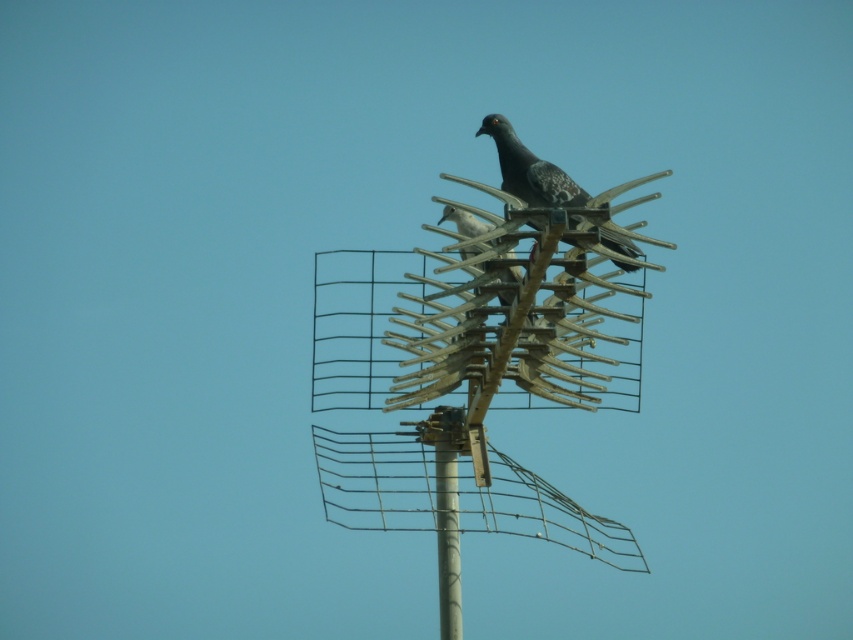
Who is more forward, (577, 200) or (463, 216)?

Point (577, 200)

Can you confirm if speckled feathered bird at center is wider than speckled feathered pigeon at center?

Indeed, speckled feathered bird at center has a greater width compared to speckled feathered pigeon at center.

This screenshot has height=640, width=853. What do you see at coordinates (529, 170) in the screenshot?
I see `speckled feathered bird at center` at bounding box center [529, 170].

Locate an element on the screen. This screenshot has width=853, height=640. speckled feathered bird at center is located at coordinates (529, 170).